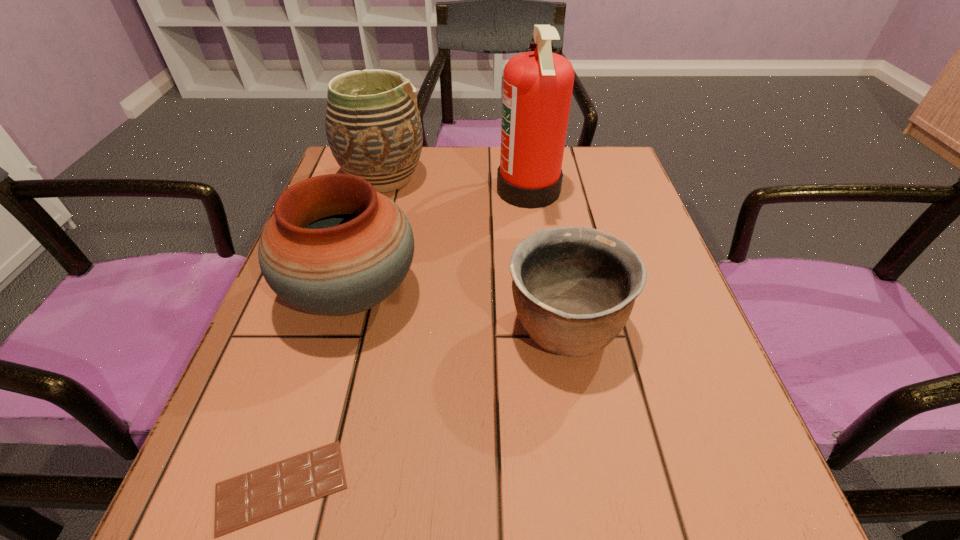
In order to click on object that is positioned at the near left corner in this screenshot , I will do `click(243, 500)`.

This screenshot has width=960, height=540. Find the location of `free region at the far edge of the desktop`. free region at the far edge of the desktop is located at coordinates (491, 158).

The image size is (960, 540). I want to click on free space at the near edge of the desktop, so click(532, 539).

The height and width of the screenshot is (540, 960). Identify the location of vacant region at the left edge of the desktop. (307, 368).

Locate an element on the screen. The image size is (960, 540). free location at the right edge of the desktop is located at coordinates (642, 310).

In the image, there is a desktop. Identify the location of vacant region at the far right corner. (595, 162).

Image resolution: width=960 pixels, height=540 pixels. What are the coordinates of `vacant space that's between the third tallest object and the nearest object` in the screenshot? It's located at (317, 389).

At what (x,y) coordinates should I click in order to perform the action: click on unoccupied area between the farthest pottery and the nearest object. Please return your answer as a coordinate pair (x, y). This screenshot has height=540, width=960. Looking at the image, I should click on (332, 332).

Locate an element on the screen. The width and height of the screenshot is (960, 540). free space between the fire extinguisher and the second shortest pottery is located at coordinates (441, 241).

You are a GUI agent. You are given a task and a screenshot of the screen. Output one action in this format:
    pyautogui.click(x=<x>, y=<y>)
    Task: Click on the unoccupied position between the farthest pottery and the tallest object
    This screenshot has width=960, height=540.
    Given the screenshot: What is the action you would take?
    pyautogui.click(x=456, y=184)